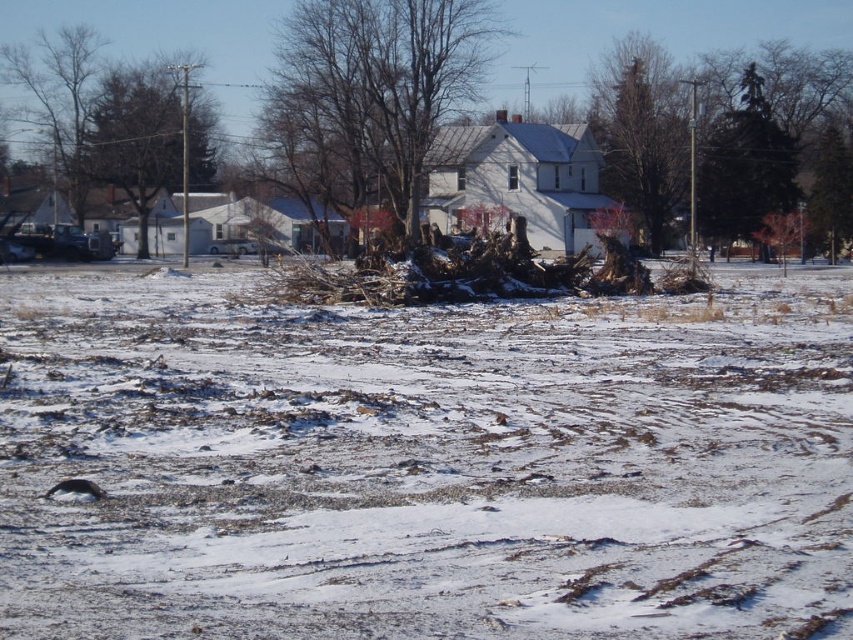
Question: Among these points, which one is nearest to the camera?

Choices:
 (A) (631, 99)
 (B) (114, 81)
 (C) (314, 38)

Answer: (C)

Question: Is bare branches at center smaller than green leafy tree at upper left?

Choices:
 (A) no
 (B) yes

Answer: (A)

Question: Which point is farther to the camera?

Choices:
 (A) (631, 180)
 (B) (41, 116)

Answer: (B)

Question: Which point is closer to the camera?

Choices:
 (A) bare branches at left
 (B) bare branches at center
 (C) green leafy tree at upper left
 (D) green textured evergreen tree at upper center

Answer: (C)

Question: Does bare branches at center come behind bare branches at left?

Choices:
 (A) no
 (B) yes

Answer: (A)

Question: Is green leafy tree at upper left above green evergreen tree at upper right?

Choices:
 (A) yes
 (B) no

Answer: (B)